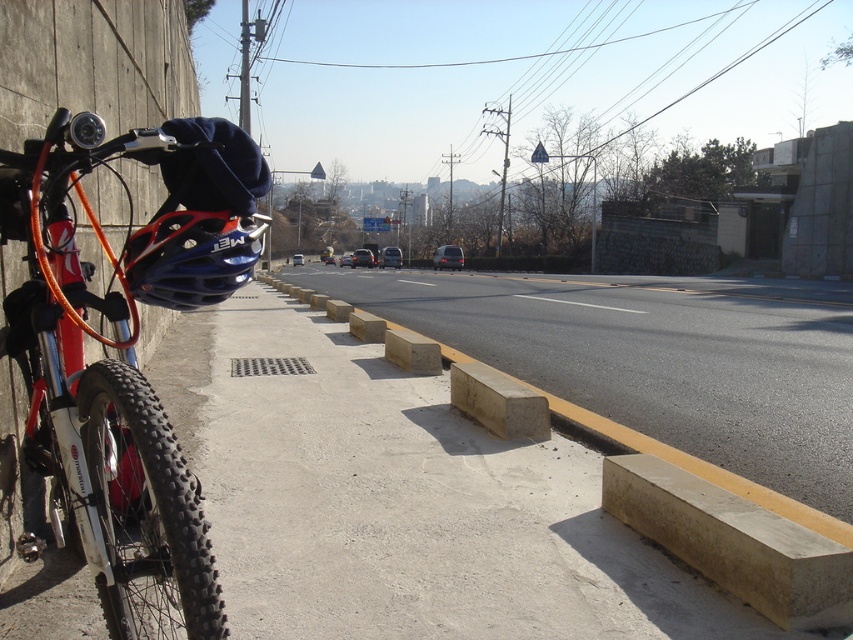
Question: Which point is farther from the camera taking this photo?

Choices:
 (A) (36, 269)
 (B) (363, 616)

Answer: (B)

Question: Observing the image, what is the correct spatial positioning of concrete at left in reference to shiny red bicycle at left?

Choices:
 (A) below
 (B) above

Answer: (B)

Question: Can you confirm if concrete at left is positioned to the right of shiny red bicycle at left?

Choices:
 (A) yes
 (B) no

Answer: (A)

Question: Which point is farther from the camera taking this photo?

Choices:
 (A) (560, 308)
 (B) (38, 381)

Answer: (A)

Question: Which object is closer to the camera taking this photo?

Choices:
 (A) concrete at left
 (B) shiny red bicycle at left

Answer: (B)

Question: Does concrete at left appear on the left side of shiny red bicycle at left?

Choices:
 (A) no
 (B) yes

Answer: (A)